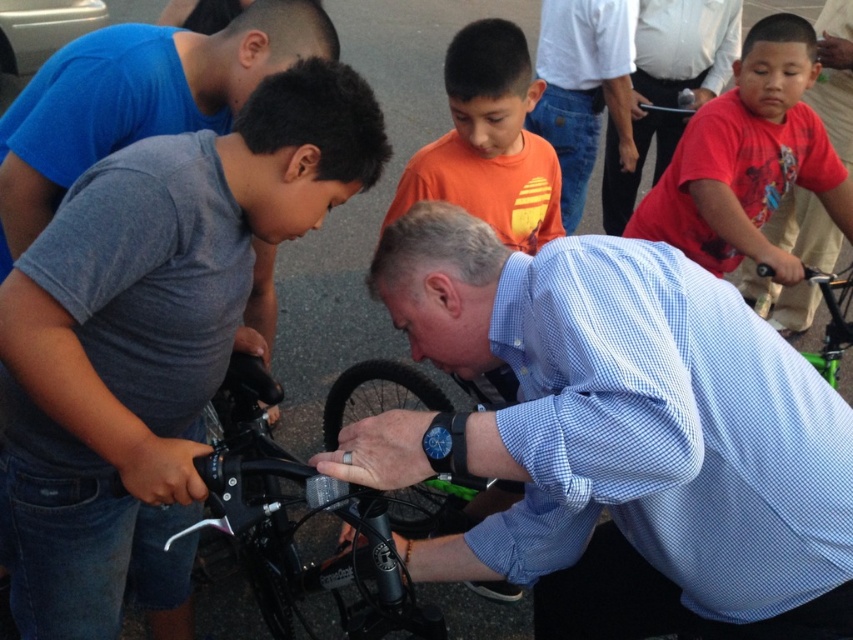
Question: Can you confirm if black rubber tire at center is positioned to the right of green matte bicycle at center?

Choices:
 (A) yes
 (B) no

Answer: (B)

Question: Observing the image, what is the correct spatial positioning of white shirt at upper center in reference to matte blue shirt at center?

Choices:
 (A) below
 (B) above

Answer: (B)

Question: Which point is farther to the camera?

Choices:
 (A) (328, 420)
 (B) (567, 28)

Answer: (B)

Question: Which object appears closest to the camera in this image?

Choices:
 (A) matte red shirt at right
 (B) green matte bicycle at center
 (C) white shirt at upper center
 (D) shiny metallic bicycle handlebar at center

Answer: (D)

Question: Which point is closer to the camera?

Choices:
 (A) (817, 211)
 (B) (102, 586)
 (C) (685, 160)
 (D) (357, 492)

Answer: (D)

Question: From the image, what is the correct spatial relationship of matte red shirt at right in relation to green matte bicycle at center?

Choices:
 (A) left
 (B) right

Answer: (A)